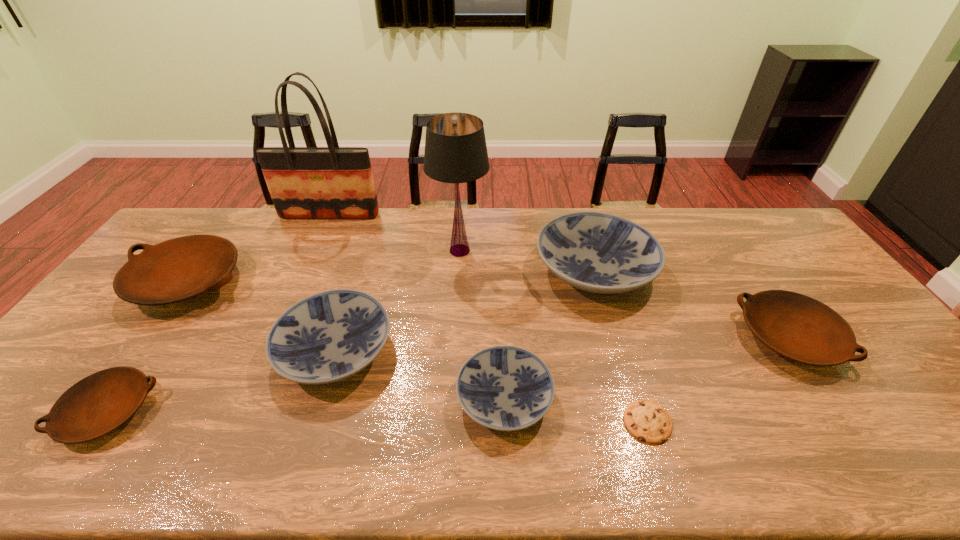
I want to click on vacant space at the near edge of the desktop, so (x=762, y=459).

In the image, there is a desktop. Identify the location of free region at the left edge. Image resolution: width=960 pixels, height=540 pixels. (65, 383).

At what (x,y) coordinates should I click in order to perform the action: click on blank area at the right edge. Please return your answer as a coordinate pair (x, y). The image size is (960, 540). Looking at the image, I should click on 890,368.

In the image, there is a desktop. Where is `blank space at the far right corner`? blank space at the far right corner is located at coordinates (777, 242).

Where is `vacant space that's between the smallest brown plate and the fourth plate from left to right`? The height and width of the screenshot is (540, 960). vacant space that's between the smallest brown plate and the fourth plate from left to right is located at coordinates coord(306,405).

Identify the location of vacant space in between the rightmost blue plate and the second smallest brown plate. (692, 304).

What are the coordinates of `unoccupied area between the second blue plate from left to right and the shortest plate` in the screenshot? It's located at (306, 405).

Locate an element on the screen. This screenshot has width=960, height=540. free space between the second smallest blue plate and the third plate from right to left is located at coordinates (420, 375).

I want to click on vacant space in between the shortest object and the fifth plate from left to right, so pos(621,346).

At what (x,y) coordinates should I click in order to perform the action: click on free area in between the farthest object and the shortest object. Please return your answer as a coordinate pair (x, y). The image size is (960, 540). Looking at the image, I should click on (489, 319).